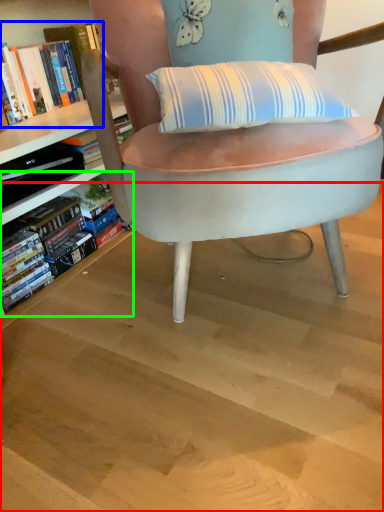
Question: Which object is positioned closest to stairwell (highlighted by a red box)? Select from book (highlighted by a blue box) and book (highlighted by a green box).

Choices:
 (A) book
 (B) book

Answer: (B)